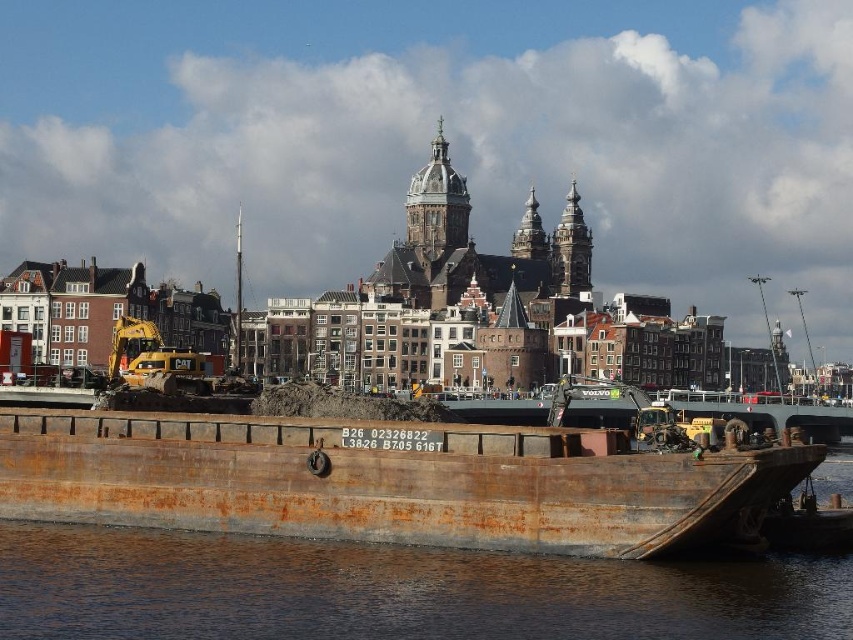
Question: Can you confirm if rusty metal barge at lower center is smaller than rusty metallic water at lower center?

Choices:
 (A) no
 (B) yes

Answer: (A)

Question: Which object appears closest to the camera in this image?

Choices:
 (A) rusty metallic water at lower center
 (B) rusty metal barge at lower center

Answer: (A)

Question: Is the position of rusty metal barge at lower center less distant than that of rusty metallic water at lower center?

Choices:
 (A) yes
 (B) no

Answer: (B)

Question: Can you confirm if rusty metal barge at lower center is positioned above rusty metallic water at lower center?

Choices:
 (A) no
 (B) yes

Answer: (B)

Question: Which object is closer to the camera taking this photo?

Choices:
 (A) rusty metal barge at lower center
 (B) rusty metallic water at lower center

Answer: (B)

Question: Which of the following is the closest to the observer?

Choices:
 (A) (747, 564)
 (B) (221, 497)

Answer: (A)